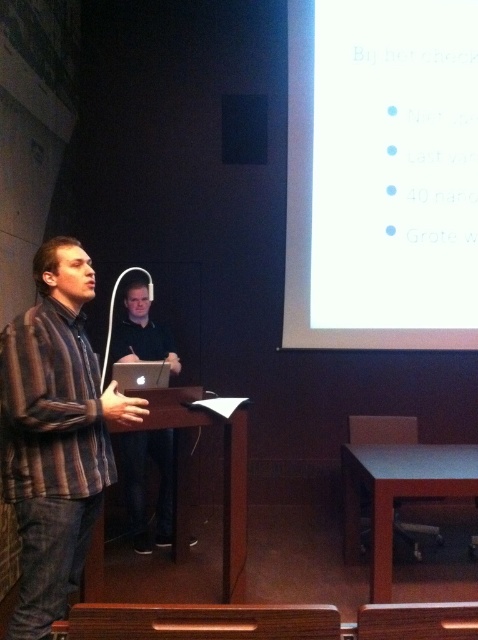
You are standing in the lecture hall and want to adjust the brightness of the white glossy projection screen at upper right. The manual says you can do this from up to 5 meters away. Can you reach the screen without moving closer?

The distance between you and the white glossy projection screen at upper right is 4.82 meters, which is within the 5 meters range specified in the manual. Therefore, you can adjust the brightness without moving closer.

You are standing in the lecture hall and want to move from the podium to the screen. There are two points marked in the image. The first point is at coordinates point (382, 208) and the second is at point (54, 369). Which point should you walk towards to reach the screen first?

You should walk towards point (54, 369) first because point (382, 208) is behind point (54, 369), so the latter is closer to you.

You are an attendee sitting in the back row of the lecture hall. You notice the white glossy projection screen at upper right and the brown striped shirt at left. Which object is closer to you from your seat?

The brown striped shirt at left is closer to you because it is positioned below the white glossy projection screen at upper right, which is further away.